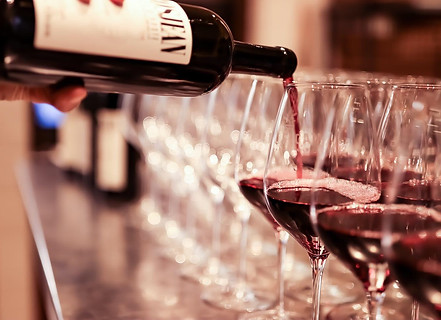
Locate an element on the screen. wine bottles is located at coordinates (112, 140), (90, 141), (70, 144), (83, 31).